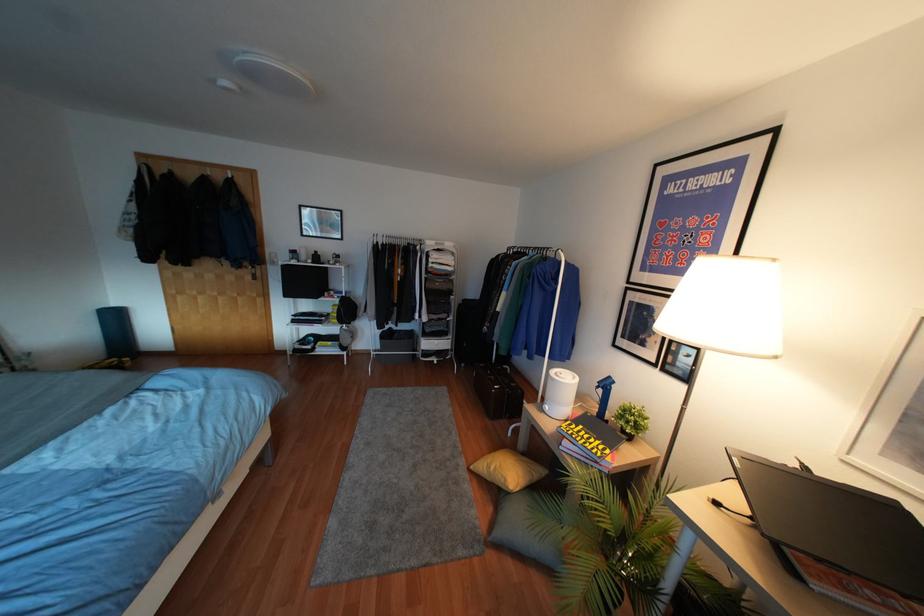
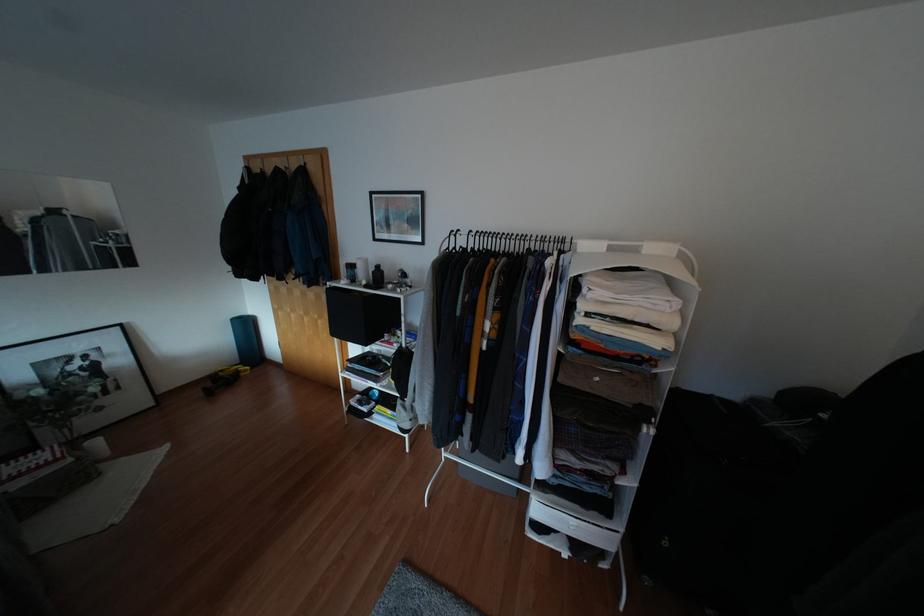
Find the pixel in the second image that matches [314,252] in the first image.

(377, 265)